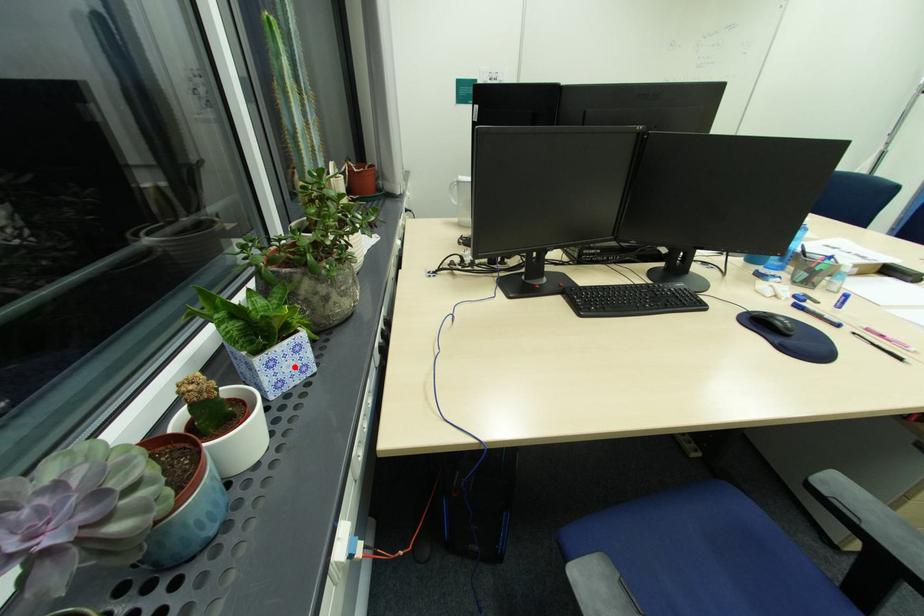
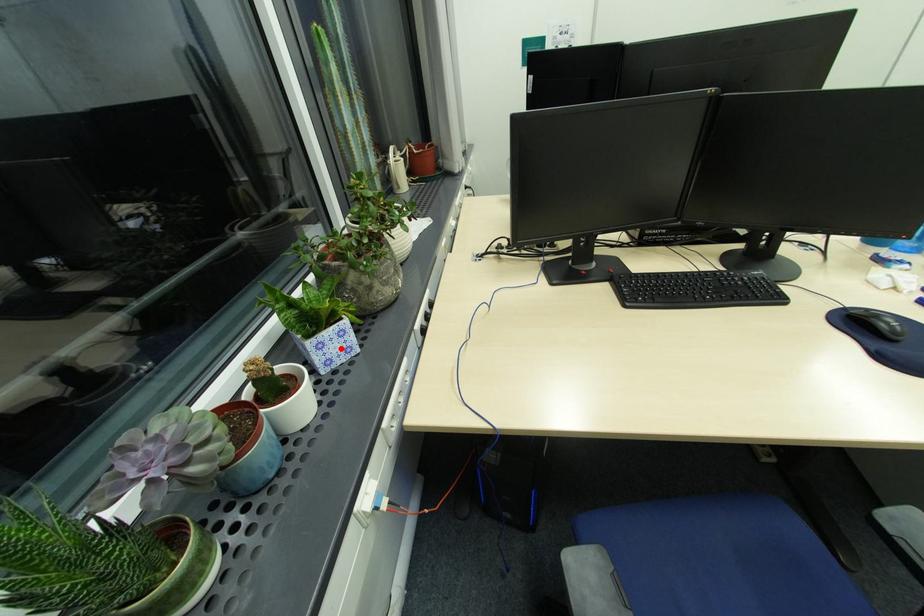
I am providing you with two images of the same scene from different viewpoints. A red point is marked on the first image and another point is marked on the second image. Are the points marked in image1 and image2 representing the same 3D position?

Yes